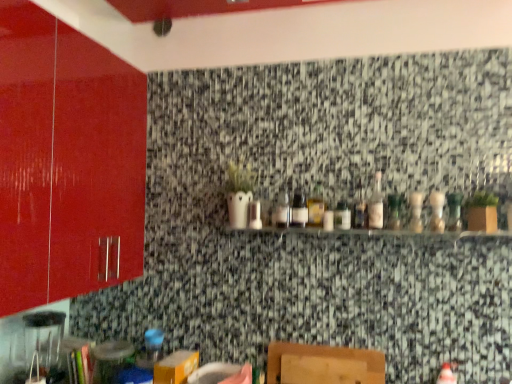
Question: From a real-world perspective, is clear glass shelf at center under translucent glass bottle at center, marked as the 1th bottle in a left-to-right arrangement?

Choices:
 (A) no
 (B) yes

Answer: (B)

Question: Considering the relative sizes of clear glass shelf at center and translucent glass bottle at center, which is the ninth bottle in right-to-left order, in the image provided, is clear glass shelf at center bigger than translucent glass bottle at center, which is the ninth bottle in right-to-left order,?

Choices:
 (A) yes
 (B) no

Answer: (A)

Question: Is clear glass shelf at center aimed at translucent glass bottle at center, which is the ninth bottle in right-to-left order?

Choices:
 (A) no
 (B) yes

Answer: (A)

Question: From a real-world perspective, is clear glass shelf at center on translucent glass bottle at center, marked as the 1th bottle in a left-to-right arrangement?

Choices:
 (A) no
 (B) yes

Answer: (A)

Question: From the image's perspective, is clear glass shelf at center on translucent glass bottle at center, marked as the 1th bottle in a left-to-right arrangement?

Choices:
 (A) yes
 (B) no

Answer: (B)

Question: From a real-world perspective, is green glass bottle at center, the 6th bottle viewed from the left, above or below translucent glass bottle at center, marked as the 1th bottle in a left-to-right arrangement?

Choices:
 (A) above
 (B) below

Answer: (A)

Question: Is green glass bottle at center, arranged as the 4th bottle when viewed from the right, bigger or smaller than translucent glass bottle at center, marked as the 1th bottle in a left-to-right arrangement?

Choices:
 (A) small
 (B) big

Answer: (B)

Question: From the image's perspective, is green glass bottle at center, the 6th bottle viewed from the left, positioned above or below translucent glass bottle at center, which is the ninth bottle in right-to-left order?

Choices:
 (A) above
 (B) below

Answer: (A)

Question: Is green glass bottle at center, the 6th bottle viewed from the left, inside or outside of translucent glass bottle at center, marked as the 1th bottle in a left-to-right arrangement?

Choices:
 (A) outside
 (B) inside

Answer: (A)

Question: Looking at the image, does translucent glass bottle at center, which is counted as the 3th bottle, starting from the right, seem bigger or smaller compared to clear glass bottle at right, the 9th bottle from the left?

Choices:
 (A) small
 (B) big

Answer: (A)

Question: From the image's perspective, is translucent glass bottle at center, which is counted as the 3th bottle, starting from the right, located above or below clear glass bottle at right, the 9th bottle from the left?

Choices:
 (A) above
 (B) below

Answer: (A)

Question: Looking at their shapes, would you say translucent glass bottle at center, acting as the 7th bottle starting from the left, is wider or thinner than clear glass bottle at right, the 9th bottle from the left?

Choices:
 (A) wide
 (B) thin

Answer: (B)

Question: Considering the positions of translucent glass bottle at center, which is counted as the 3th bottle, starting from the right, and clear glass bottle at right, the 9th bottle from the left, in the image, is translucent glass bottle at center, which is counted as the 3th bottle, starting from the right, taller or shorter than clear glass bottle at right, the 9th bottle from the left,?

Choices:
 (A) tall
 (B) short

Answer: (B)

Question: From the image's perspective, is clear glass bottle at center, the 5th bottle when ordered from right to left, located above or below clear glass bottle at center, which appears as the seventh bottle when viewed from the right?

Choices:
 (A) above
 (B) below

Answer: (A)

Question: From their relative heights in the image, would you say clear glass bottle at center, the 5th bottle when ordered from right to left, is taller or shorter than clear glass bottle at center, positioned as the third bottle in left-to-right order?

Choices:
 (A) tall
 (B) short

Answer: (A)